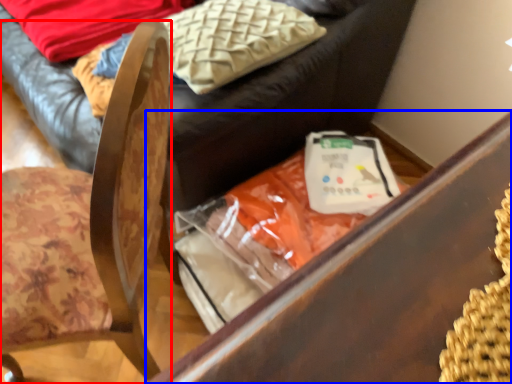
Question: Which point is closer to the camera, chair (highlighted by a red box) or furniture (highlighted by a blue box)?

Choices:
 (A) chair
 (B) furniture

Answer: (A)